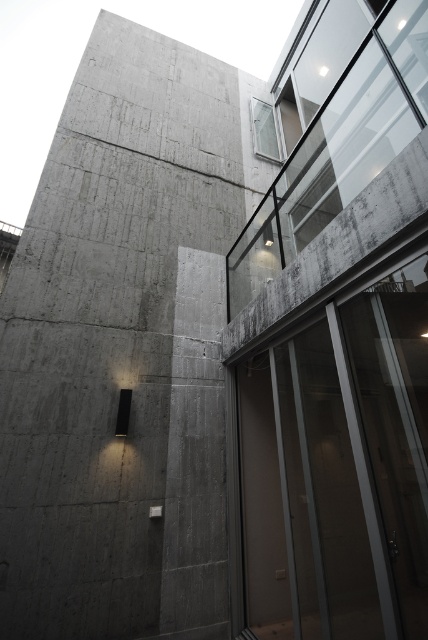
Does gray concrete wall at left have a lesser height compared to transparent glass door at center?

Correct, gray concrete wall at left is not as tall as transparent glass door at center.

Is gray concrete wall at left wider than transparent glass door at center?

No.

The image size is (428, 640). What do you see at coordinates (124, 348) in the screenshot? I see `gray concrete wall at left` at bounding box center [124, 348].

You are a GUI agent. You are given a task and a screenshot of the screen. Output one action in this format:
    pyautogui.click(x=<x>, y=<y>)
    Task: Click on the gray concrete wall at left
    
    Given the screenshot: What is the action you would take?
    pyautogui.click(x=124, y=348)